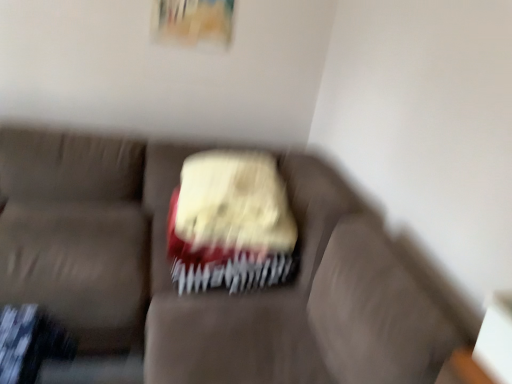
What do you see at coordinates (230, 223) in the screenshot?
I see `white textured cake at center` at bounding box center [230, 223].

Identify the location of white textured cake at center. (230, 223).

What is the approximate height of matte fabric couch at center?

The height of matte fabric couch at center is 33.59 inches.

Locate an element on the screen. This screenshot has width=512, height=384. matte fabric couch at center is located at coordinates (212, 292).

What is the approximate width of matte fabric couch at center?

It is 5.51 feet.

This screenshot has width=512, height=384. What do you see at coordinates (212, 292) in the screenshot? I see `matte fabric couch at center` at bounding box center [212, 292].

Locate an element on the screen. white textured cake at center is located at coordinates (230, 223).

Which object is positioned more to the left, matte fabric couch at center or white textured cake at center?

matte fabric couch at center is more to the left.

In the scene shown: Does matte fabric couch at center come behind white textured cake at center?

No, it is not.

Considering the points (114, 337) and (195, 176), which point is behind, point (114, 337) or point (195, 176)?

Point (195, 176)

From the image's perspective, who appears lower, matte fabric couch at center or white textured cake at center?

matte fabric couch at center is shown below in the image.

From a real-world perspective, which is physically above, matte fabric couch at center or white textured cake at center?

white textured cake at center.

In terms of width, does matte fabric couch at center look wider or thinner when compared to white textured cake at center?

Clearly, matte fabric couch at center has more width compared to white textured cake at center.

Considering the sizes of objects matte fabric couch at center and white textured cake at center in the image provided, who is taller, matte fabric couch at center or white textured cake at center?

Standing taller between the two is matte fabric couch at center.

Who is smaller, matte fabric couch at center or white textured cake at center?

white textured cake at center is smaller.

Is matte fabric couch at center surrounding white textured cake at center?

Yes, white textured cake at center is inside matte fabric couch at center.

Is matte fabric couch at center directly adjacent to white textured cake at center?

No, matte fabric couch at center is not beside white textured cake at center.

Is white textured cake at center at the back of matte fabric couch at center?

Absolutely, matte fabric couch at center is directed away from white textured cake at center.

What's the angular difference between matte fabric couch at center and white textured cake at center's facing directions?

The angle between the facing direction of matte fabric couch at center and the facing direction of white textured cake at center is 2.65 degrees.

At what (x,y) coordinates should I click in order to perform the action: click on cake on the right of matte fabric couch at center. Please return your answer as a coordinate pair (x, y). Image resolution: width=512 pixels, height=384 pixels. Looking at the image, I should click on (230, 223).

Looking at this image, based on their positions, is white textured cake at center located to the left or right of matte fabric couch at center?

white textured cake at center is to the right of matte fabric couch at center.

Is the depth of white textured cake at center greater than that of matte fabric couch at center?

Yes, white textured cake at center is further from the camera.

Considering the points (280, 233) and (384, 325), which point is behind, point (280, 233) or point (384, 325)?

The point (280, 233) is behind.

From the image's perspective, between white textured cake at center and matte fabric couch at center, who is located below?

matte fabric couch at center appears lower in the image.

From a real-world perspective, is white textured cake at center positioned above or below matte fabric couch at center?

white textured cake at center is above matte fabric couch at center.

Considering the sizes of objects white textured cake at center and matte fabric couch at center in the image provided, who is thinner, white textured cake at center or matte fabric couch at center?

Thinner between the two is white textured cake at center.

Based on the photo, is white textured cake at center taller than matte fabric couch at center?

No.

Between white textured cake at center and matte fabric couch at center, which one has smaller size?

white textured cake at center.

Could matte fabric couch at center be considered to be inside white textured cake at center?

Definitely not — matte fabric couch at center is not inside white textured cake at center.

Is white textured cake at center not near matte fabric couch at center?

white textured cake at center is near matte fabric couch at center, not far away.

Is matte fabric couch at center at the back of white textured cake at center?

Yes, white textured cake at center is positioned with its back facing matte fabric couch at center.

You are a GUI agent. You are given a task and a screenshot of the screen. Output one action in this format:
    pyautogui.click(x=<x>, y=<y>)
    Task: Click on the cake above the matte fabric couch at center (from the image's perspective)
    Image resolution: width=512 pixels, height=384 pixels.
    Given the screenshot: What is the action you would take?
    pos(230,223)

The height and width of the screenshot is (384, 512). In order to click on cake behind the matte fabric couch at center in this screenshot , I will do `click(230, 223)`.

Identify the location of studio couch located below the white textured cake at center (from the image's perspective). Image resolution: width=512 pixels, height=384 pixels. (212, 292).